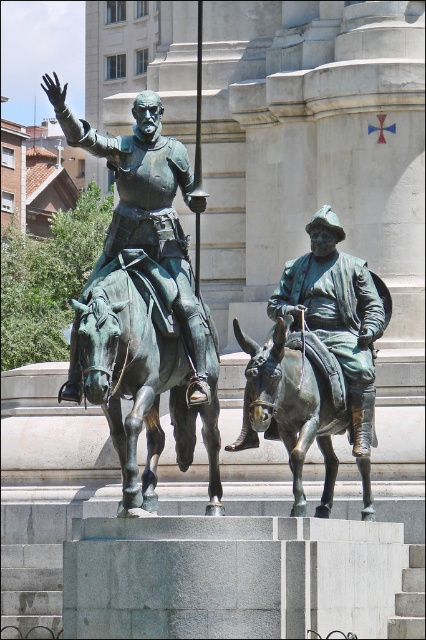
Is bronze statue of man on horse at upper center closer to the viewer compared to bronze statue of man at center?

That is True.

Between point (141, 125) and point (377, 321), which one is positioned in front?

Point (141, 125) is more forward.

Is point (149, 92) less distant than point (362, 324)?

Yes, point (149, 92) is closer to viewer.

You are a GUI agent. You are given a task and a screenshot of the screen. Output one action in this format:
    pyautogui.click(x=<x>, y=<y>)
    Task: Click on the bronze statue of man on horse at upper center
    This screenshot has width=426, height=640.
    Given the screenshot: What is the action you would take?
    pyautogui.click(x=146, y=209)

Is bronze statue of man at center to the right of bronze donkey at center from the viewer's perspective?

Indeed, bronze statue of man at center is positioned on the right side of bronze donkey at center.

Between bronze statue of man at center and bronze donkey at center, which one has more height?

bronze statue of man at center is taller.

At what (x,y) coordinates should I click in order to perform the action: click on bronze statue of man at center. Please return your answer as a coordinate pair (x, y). Looking at the image, I should click on tap(336, 312).

Locate an element on the screen. Image resolution: width=426 pixels, height=640 pixels. bronze statue of man at center is located at coordinates (336, 312).

Can you confirm if bronze/greenish metal horse at center-left is smaller than bronze statue of man on horse at upper center?

Indeed, bronze/greenish metal horse at center-left has a smaller size compared to bronze statue of man on horse at upper center.

Which of these two, bronze/greenish metal horse at center-left or bronze statue of man on horse at upper center, stands taller?

bronze statue of man on horse at upper center is taller.

Is point (184, 424) less distant than point (123, 188)?

No, (184, 424) is further to viewer.

At what (x,y) coordinates should I click in order to perform the action: click on bronze/greenish metal horse at center-left. Please return your answer as a coordinate pair (x, y). This screenshot has width=426, height=640. Looking at the image, I should click on (143, 372).